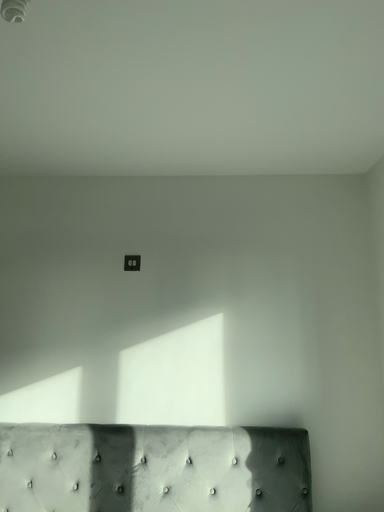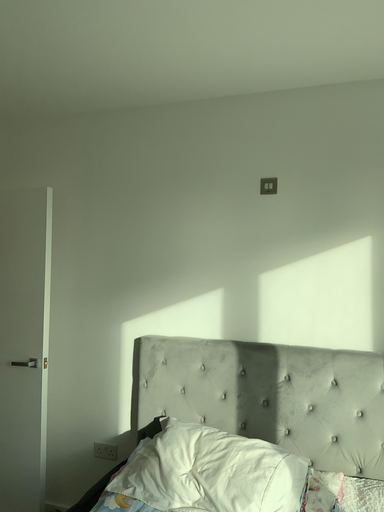
Question: How did the camera likely rotate when shooting the video?

Choices:
 (A) rotated upward
 (B) rotated downward

Answer: (B)